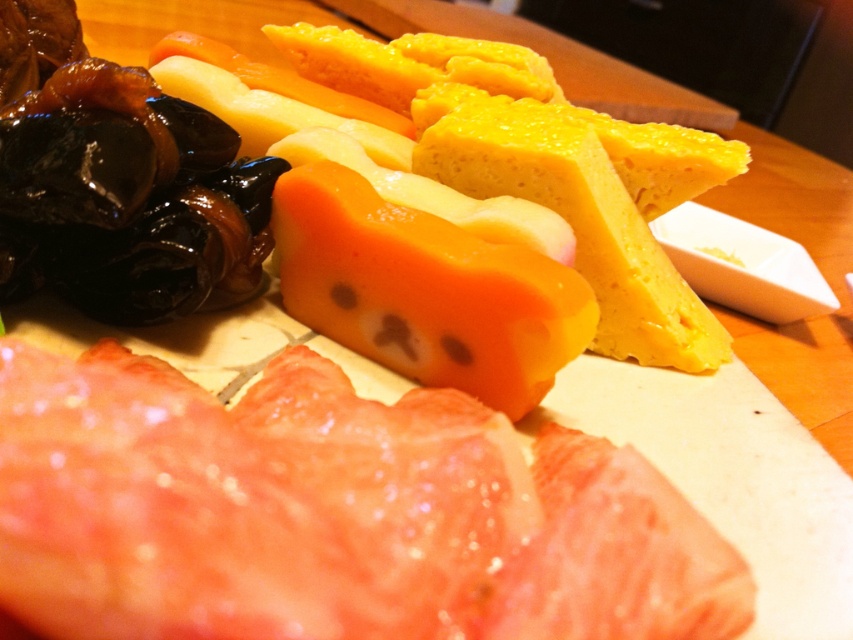
You are a chef preparing a dish and need to place both the pink raw meat at lower left and the yellow crumbly cheese at upper center on a plate. Based on their positions on the cutting board, which item is closer to the edge of the plate?

The pink raw meat at lower left is closer to the edge of the plate because it is shorter than the yellow crumbly cheese at upper center, which means it is positioned lower on the cutting board and thus nearer to the edge.

You are holding a 8 inch ruler and want to measure the distance from the camera to the point at coordinates point [329,611]. Can your ruler reach that point?

The point at coordinates point [329,611] is 7.98 inches away from the camera, so yes, the ruler can reach that point since it is exactly 8 inches long.

Based on the scene description, where is the yellow crumbly cheese at upper center located in terms of its 2D coordinates?

The yellow crumbly cheese at upper center is located at the 2D coordinates of point (x=544, y=193).